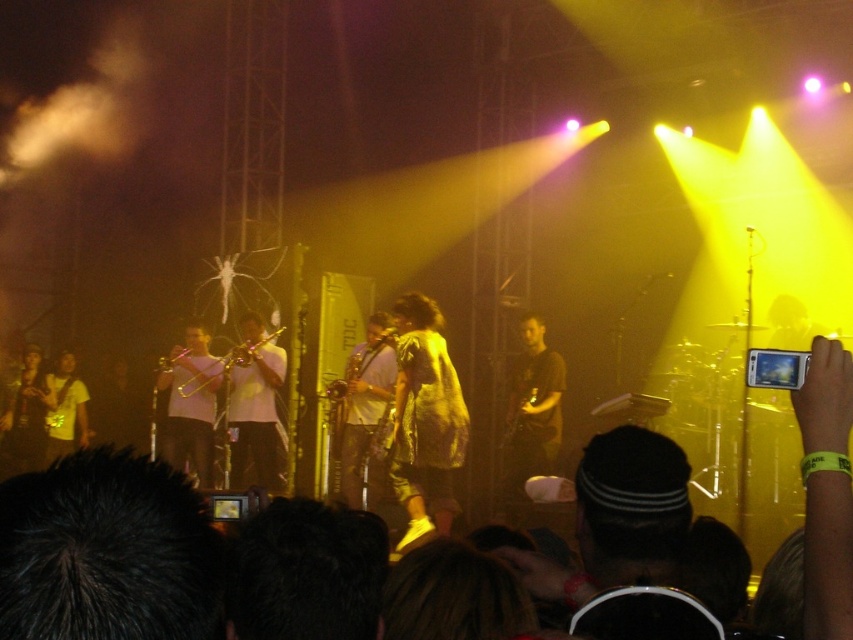
You are a stagehand who needs to adjust the microphone stands for the band members. The white matte trumpet at center and the metallic gold guitar at center are both on stage. Which instrument requires a taller microphone stand?

The white matte trumpet at center requires a taller microphone stand because it is taller than the metallic gold guitar at center.

You are a stagehand setting up a music stand for the white matte trumpet at center and the metallic gold guitar at center. If the music stand can only accommodate one instrument at a time, which instrument should you place it next to first based on their widths?

The white matte trumpet at center is wider than the metallic gold guitar at center, so you should place the music stand next to the white matte trumpet at center first to ensure it has enough space.

You are a photographer at the concert and want to capture a photo that includes both the gold brass trombone at center and the metallic gold guitar at center. Based on their positions, which instrument should you focus on first to ensure both are in frame?

The gold brass trombone at center is above the metallic gold guitar at center, so you should focus on the metallic gold guitar at center first to ensure both are in frame.